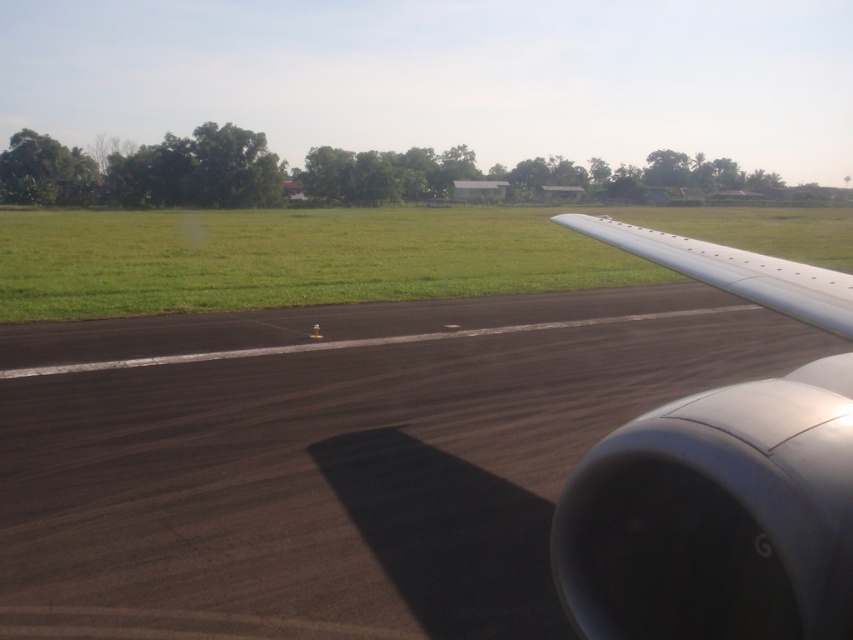
You are a pilot trying to align your aircraft with the runway. Based on the coordinates provided, where exactly is the black asphalt runway at center located in the image?

The black asphalt runway at center is located at the 2D coordinates point of (334,458).

You are a pilot preparing for takeoff and need to ensure there is enough space between the metallic gray wing at right and the green grass at center to avoid any obstruction. Based on the image, what is the minimum distance you should maintain between these two points?

The minimum distance you should maintain between the metallic gray wing at right and the green grass at center is at least 41.77 meters to avoid obstruction.

You are a pilot preparing for takeoff and need to ensure that the runway is long enough for your aircraft. Based on the image, which object takes up more area in the scene, indicating its relative size? Please choose between the black asphalt runway at center and the silver metallic wing at right.

The silver metallic wing at right takes up more area in the scene than the black asphalt runway at center, as the runway occupies less space according to the description.